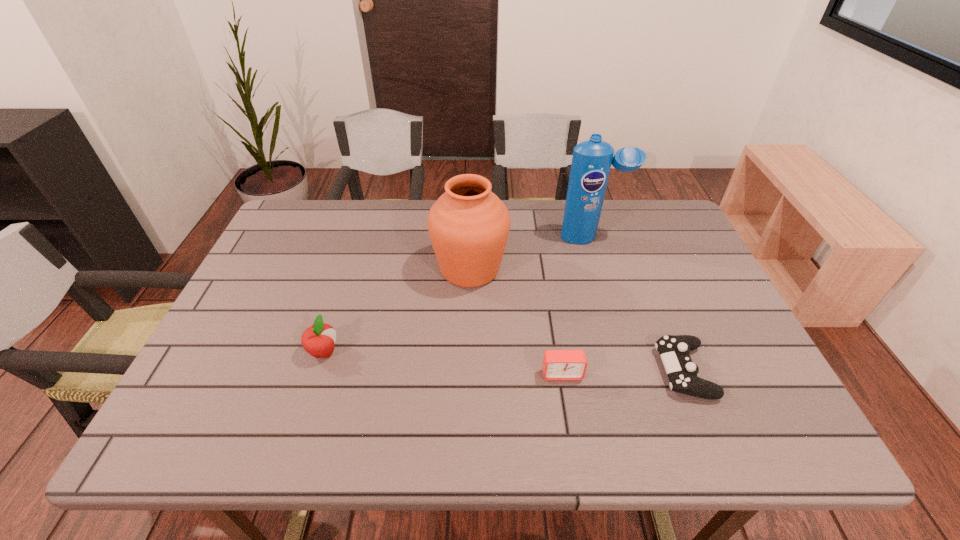
At what (x,y) coordinates should I click in order to perform the action: click on free region at the left edge of the desktop. Please return your answer as a coordinate pair (x, y). Image resolution: width=960 pixels, height=540 pixels. Looking at the image, I should click on (281, 330).

Where is `vacant space at the right edge of the desktop`? Image resolution: width=960 pixels, height=540 pixels. vacant space at the right edge of the desktop is located at coordinates (705, 276).

The width and height of the screenshot is (960, 540). What are the coordinates of `vacant space at the near left corner` in the screenshot? It's located at (210, 422).

The height and width of the screenshot is (540, 960). Identify the location of vacant space at the far right corner of the desktop. 672,220.

Locate an element on the screen. vacant space at the near right corner is located at coordinates point(761,429).

Identify the location of vacant area between the shortest object and the tallest object. This screenshot has height=540, width=960. (637, 305).

Identify the location of vacant area that lies between the fourth object from right to left and the third object from left to right. (516, 321).

Where is `blank region between the leftmost object and the control`? The height and width of the screenshot is (540, 960). blank region between the leftmost object and the control is located at coordinates (504, 361).

Where is `unoccupied area between the tallest object and the leftmost object`? unoccupied area between the tallest object and the leftmost object is located at coordinates (458, 295).

Where is `vacant point located between the fourth tallest object and the control`? vacant point located between the fourth tallest object and the control is located at coordinates (623, 372).